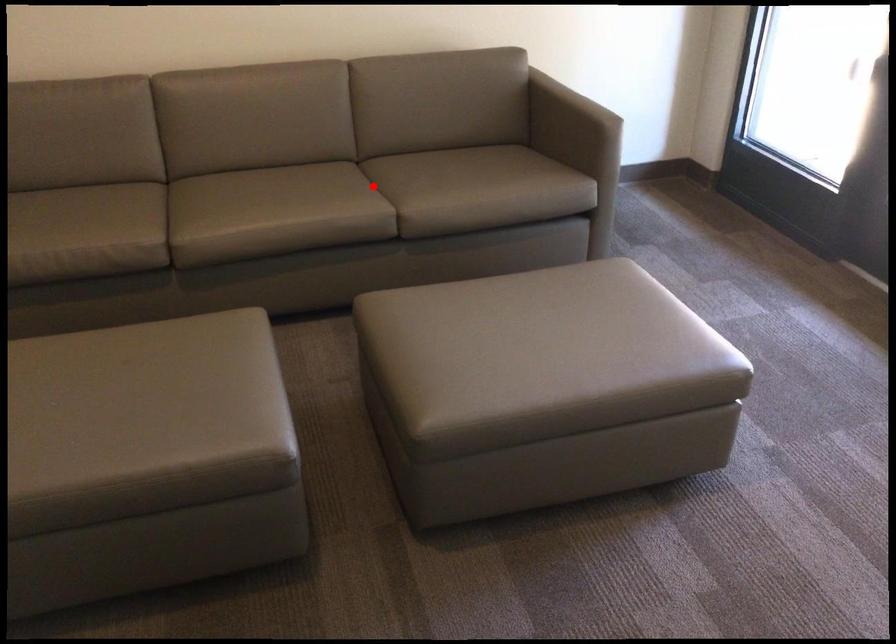
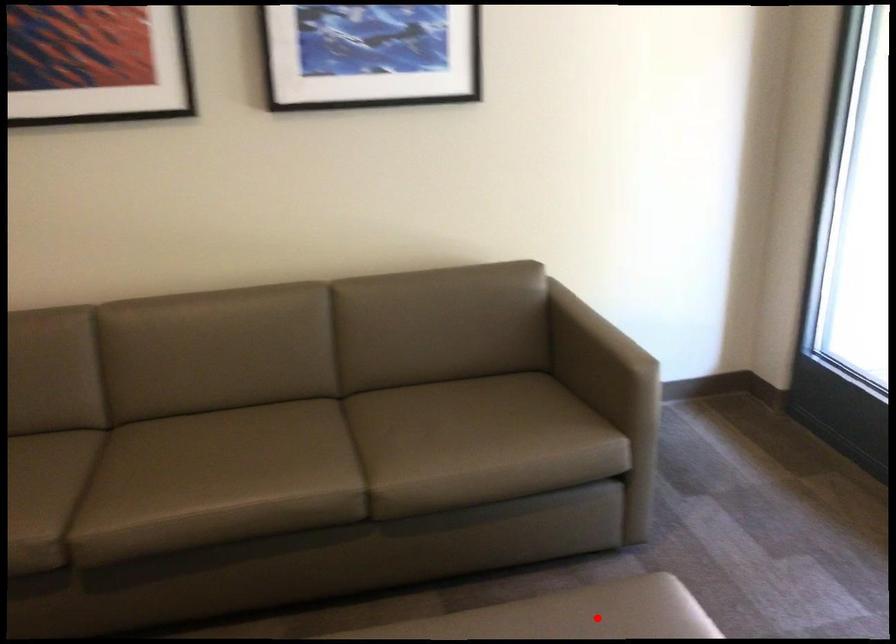
I am providing you with two images of the same scene from different viewpoints. A red point is marked on the first image and another point is marked on the second image. Is the red point in image1 aligned with the point shown in image2?

No